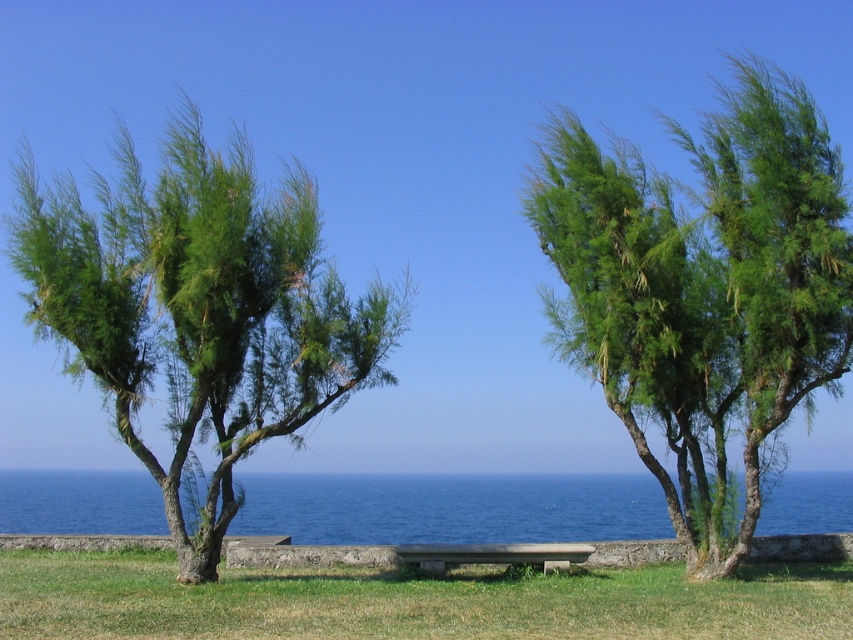
Looking at this image, you are standing at the edge of the grassy area and want to walk to the bench by the stone wall. Which direction should you go relative to the green leafy tree at left and the green grass at center?

You should walk towards the green grass at center, as the green leafy tree at left is to the right of the green grass at center, meaning the grass is to the left of the tree. Since the bench is near the wall separating the grass from the sea, moving towards the grass at center would lead you in the direction of the bench.

You are standing at the point marked as point (704, 292). Which object is directly in front of you?

The green leafy tree at center is located at point (704, 292), so that is the object directly in front of you.

You are standing in the coastal scene and want to sit on the bench facing the ocean. However, you notice the green leafy tree at center and the blue liquid water at center. Which object is closer to you, and why?

The green leafy tree at center is closer to you because it is positioned over the blue liquid water at center, meaning the tree is in front of the water in the scene.